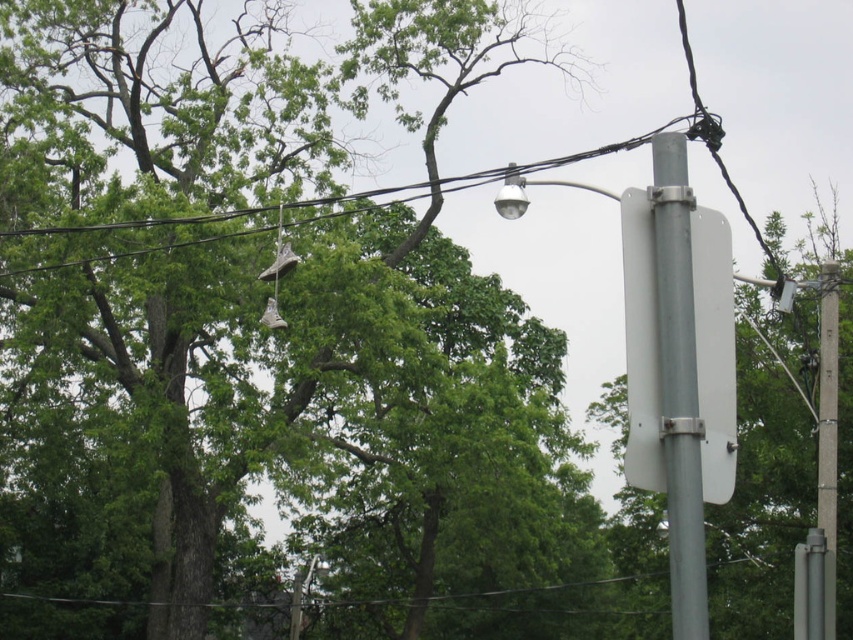
You are standing in front of the streetlight pole and want to take a photo of the metallic gray street light at center right. If your camera has a maximum focus range of 4 meters, will it be able to capture the street light clearly?

The metallic gray street light at center right is 4.05 meters away from the camera. Since the camera can only focus up to 4 meters, it will not be able to capture the street light clearly as the distance exceeds the maximum focus range.